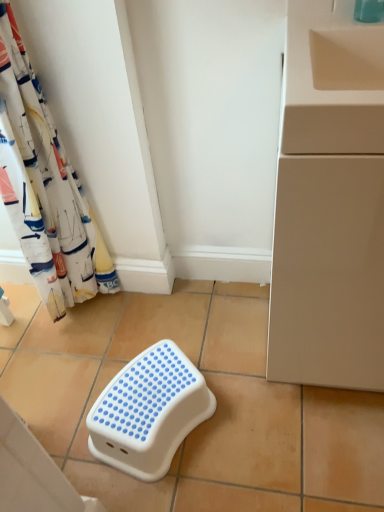
Find the location of a particular element. spots to the right of white plastic step stool at center is located at coordinates (258, 417).